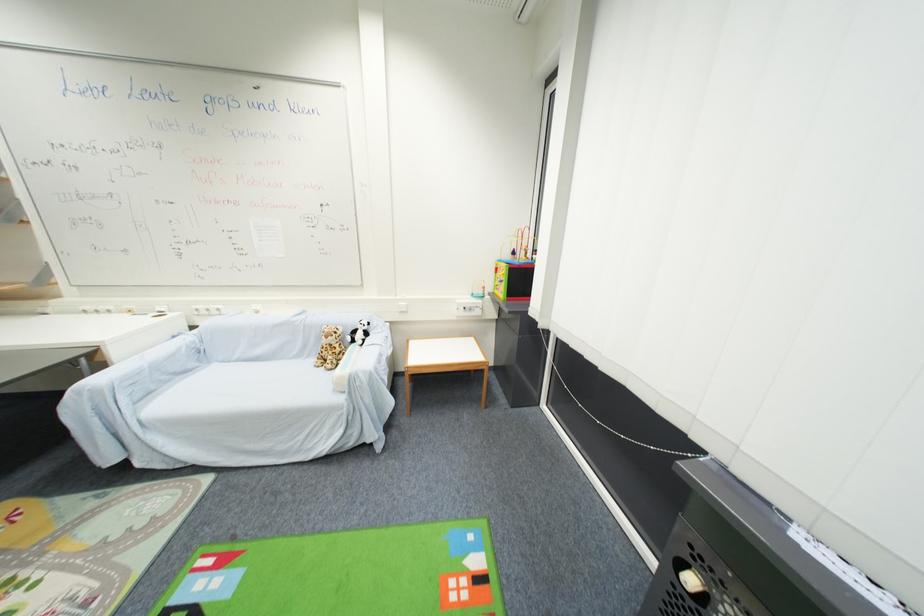
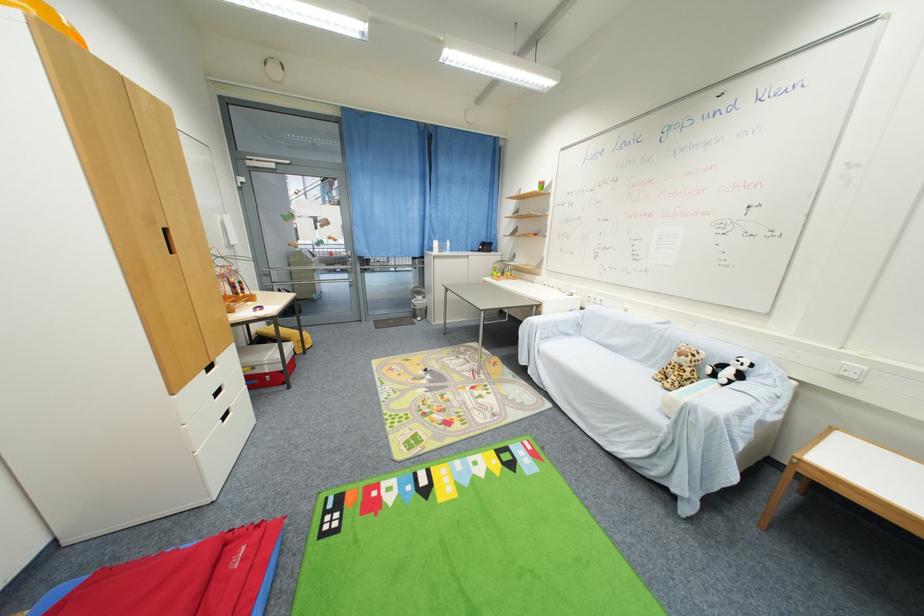
The point at [333,363] is marked in the first image. Where is the corresponding point in the second image?

(675, 382)